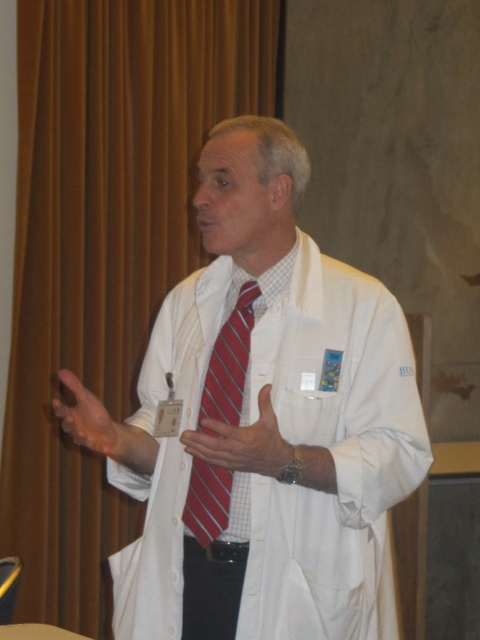
Is brown fabric curtain at left further to the viewer compared to matte white hand at lower left?

Yes.

Does point (181, 17) come closer to viewer compared to point (60, 410)?

No, it is behind (60, 410).

Between point (159, 93) and point (156, 445), which one is positioned behind?

The point (159, 93) is more distant.

The image size is (480, 640). I want to click on brown fabric curtain at left, so click(105, 250).

What are the coordinates of `white smooth lab coat at center` in the screenshot? It's located at (330, 452).

Which is in front, point (395, 474) or point (81, 385)?

Point (81, 385) is in front.

Locate an element on the screen. Image resolution: width=480 pixels, height=640 pixels. white smooth lab coat at center is located at coordinates (330, 452).

Is white smooth lab coat at center shorter than matte red tie at center?

In fact, white smooth lab coat at center may be taller than matte red tie at center.

This screenshot has width=480, height=640. What do you see at coordinates (330, 452) in the screenshot?
I see `white smooth lab coat at center` at bounding box center [330, 452].

Image resolution: width=480 pixels, height=640 pixels. In order to click on white smooth lab coat at center in this screenshot , I will do `click(330, 452)`.